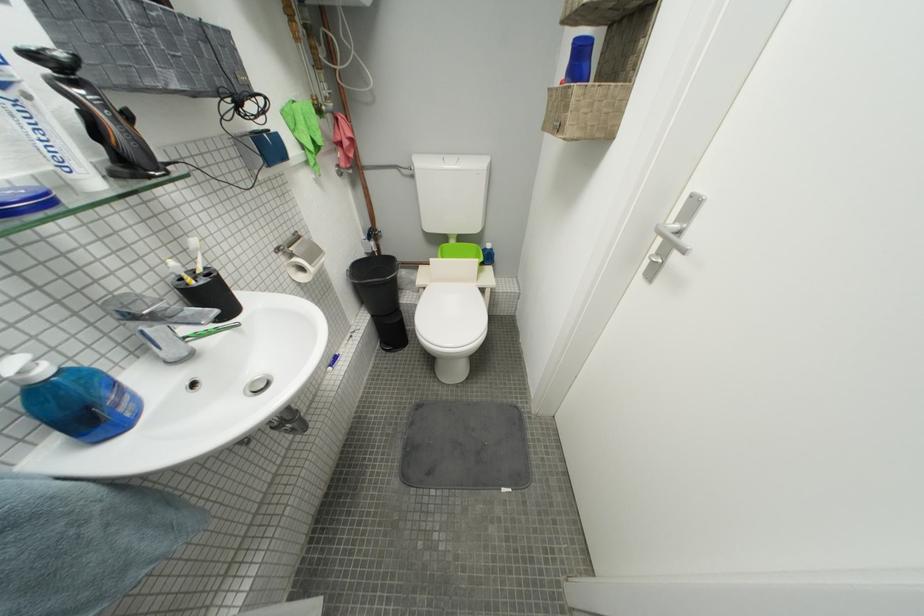
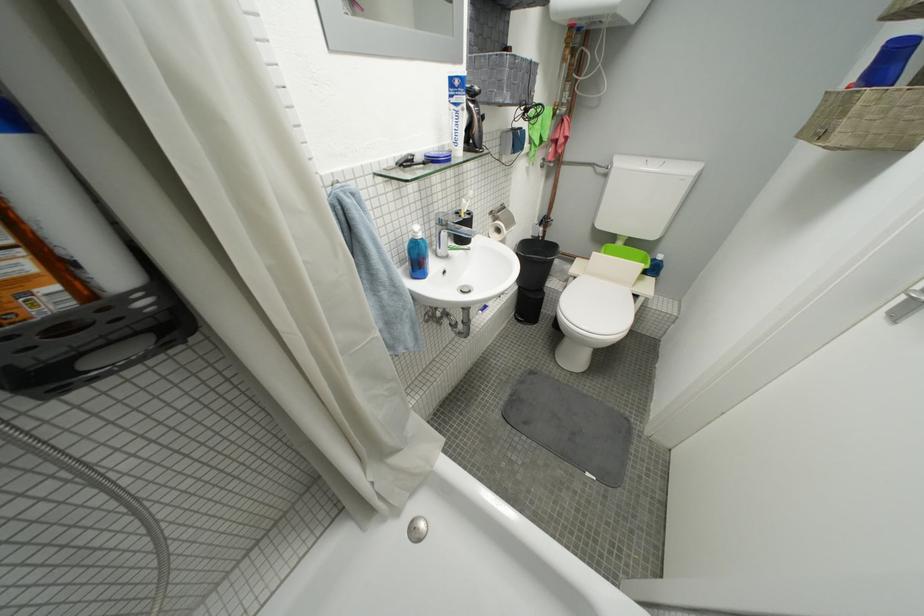
The point at (139, 325) is marked in the first image. Where is the corresponding point in the second image?

(447, 230)